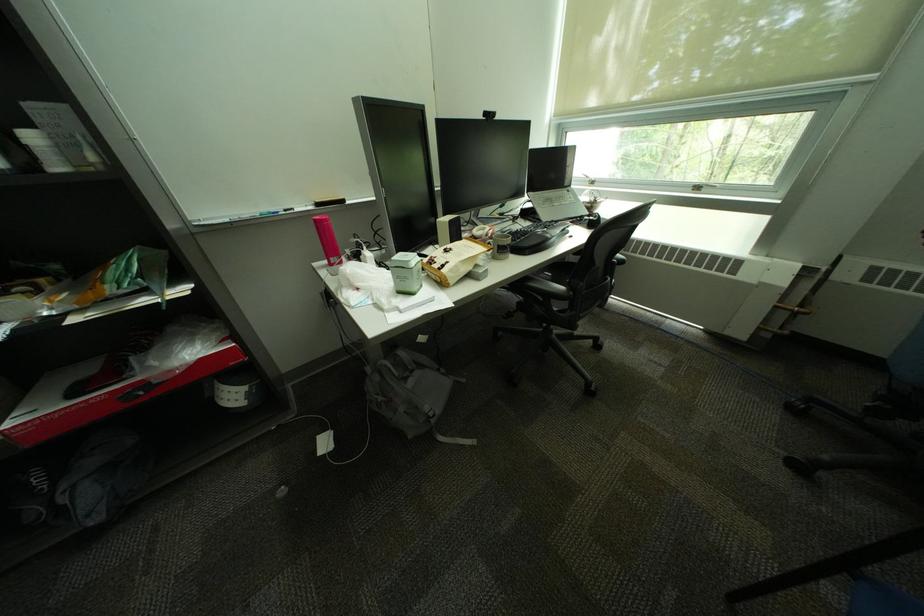
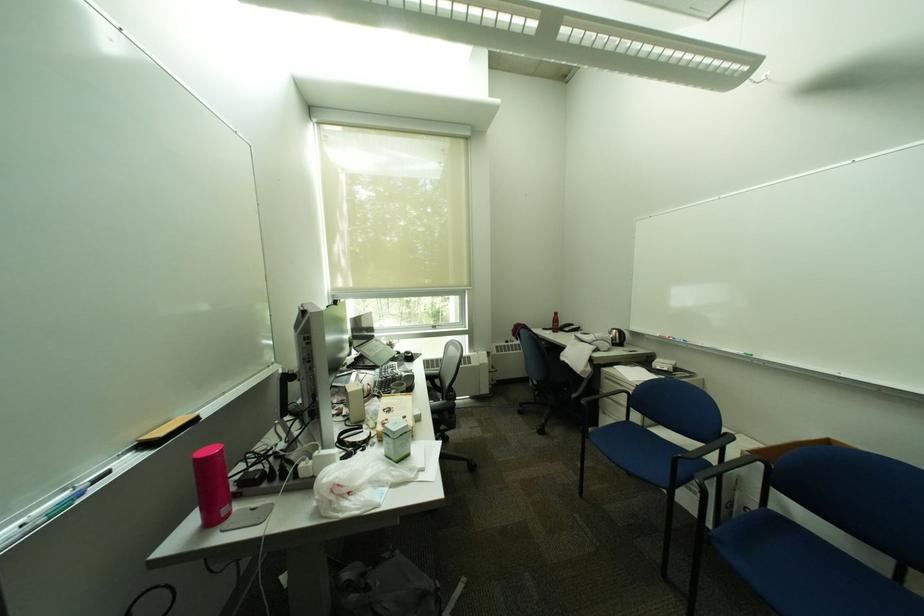
Locate, in the second image, the point that corresponds to the point at 454,376 in the first image.

(400, 560)